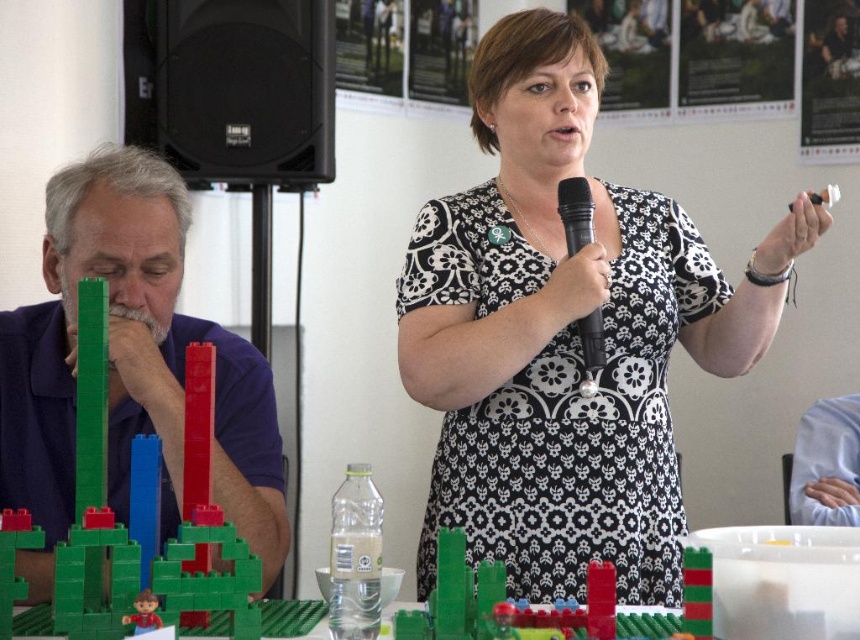
Question: Estimate the real-world distances between objects in this image. Which object is closer to the purple matte shirt at left?

Choices:
 (A) black printed dress at center
 (B) green plastic blocks at center
 (C) black matte speaker at upper left

Answer: (A)

Question: Which point is farther from the camera taking this photo?

Choices:
 (A) tap(169, 83)
 (B) tap(576, 323)

Answer: (A)

Question: Does black printed dress at center appear over green plastic blocks at center?

Choices:
 (A) no
 (B) yes

Answer: (B)

Question: Which object appears farthest from the camera in this image?

Choices:
 (A) green plastic blocks at center
 (B) black matte speaker at upper left
 (C) black printed dress at center

Answer: (B)

Question: Is black printed dress at center thinner than black matte speaker at upper left?

Choices:
 (A) no
 (B) yes

Answer: (A)

Question: In this image, where is green plastic blocks at center located relative to black plastic microphone at center?

Choices:
 (A) left
 (B) right

Answer: (A)